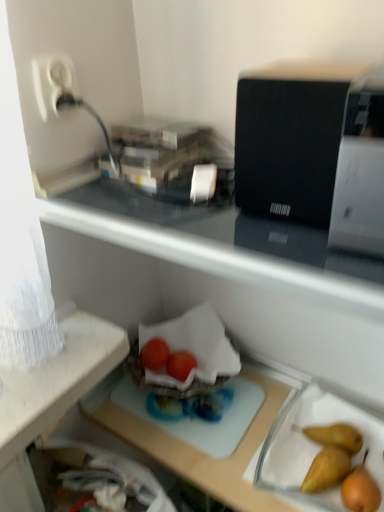
What is the approximate height of glossy plastic tomatoes at center, the first green vegetables when ordered from left to right?

glossy plastic tomatoes at center, the first green vegetables when ordered from left to right, is 2.86 inches tall.

The image size is (384, 512). Describe the element at coordinates (180, 365) in the screenshot. I see `glossy plastic tomatoes at center, which is the first green vegetables in right-to-left order` at that location.

In order to face glossy plastic tomatoes at center, positioned as the 2th green vegetables in left-to-right order, should I rotate leftwards or rightwards?

Turn left approximately 1.354 degrees to face it.

The width and height of the screenshot is (384, 512). I want to click on transparent plastic tray at center, so click(51, 396).

Describe the element at coordinates (361, 170) in the screenshot. I see `white glossy printer at upper right, arranged as the second appliance when viewed from the left` at that location.

Find the location of a particular element. Image resolution: width=384 pixels, height=512 pixels. black matte speaker at upper right, the first appliance positioned from the left is located at coordinates (290, 139).

Find the location of a particular element. smooth brown pear at lower right is located at coordinates (340, 467).

I want to click on glossy plastic tomatoes at center, the second green vegetables viewed from the right, so click(154, 354).

Is transparent plastic tray at center bigger than white glossy printer at upper right, which appears as the first appliance when viewed from the right?

Yes, transparent plastic tray at center is bigger than white glossy printer at upper right, which appears as the first appliance when viewed from the right.

Consider the image. Can you confirm if transparent plastic tray at center is taller than white glossy printer at upper right, which appears as the first appliance when viewed from the right?

Indeed, transparent plastic tray at center has a greater height compared to white glossy printer at upper right, which appears as the first appliance when viewed from the right.

Based on their positions, is transparent plastic tray at center located to the left or right of white glossy printer at upper right, which appears as the first appliance when viewed from the right?

From the image, it's evident that transparent plastic tray at center is to the left of white glossy printer at upper right, which appears as the first appliance when viewed from the right.

Does transparent plastic tray at center lie behind white glossy printer at upper right, arranged as the second appliance when viewed from the left?

Yes.

From a real-world perspective, is glossy plastic tomatoes at center, positioned as the 2th green vegetables in left-to-right order, physically above white plastic plug at upper left?

Incorrect, from a real-world perspective, glossy plastic tomatoes at center, positioned as the 2th green vegetables in left-to-right order, is lower than white plastic plug at upper left.

Could you tell me if glossy plastic tomatoes at center, positioned as the 2th green vegetables in left-to-right order, is turned towards white plastic plug at upper left?

No, glossy plastic tomatoes at center, positioned as the 2th green vegetables in left-to-right order, is not oriented towards white plastic plug at upper left.

From the image's perspective, does glossy plastic tomatoes at center, positioned as the 2th green vegetables in left-to-right order, appear lower than white plastic plug at upper left?

Correct, glossy plastic tomatoes at center, positioned as the 2th green vegetables in left-to-right order, appears lower than white plastic plug at upper left in the image.

Considering the relative sizes of glossy plastic tomatoes at center, which is the first green vegetables in right-to-left order, and white plastic plug at upper left in the image provided, is glossy plastic tomatoes at center, which is the first green vegetables in right-to-left order, smaller than white plastic plug at upper left?

Yes.

Considering the relative sizes of white glossy printer at upper right, which appears as the first appliance when viewed from the right, and glossy plastic tomatoes at center, positioned as the 2th green vegetables in left-to-right order, in the image provided, is white glossy printer at upper right, which appears as the first appliance when viewed from the right, thinner than glossy plastic tomatoes at center, positioned as the 2th green vegetables in left-to-right order,?

Incorrect, the width of white glossy printer at upper right, which appears as the first appliance when viewed from the right, is not less than that of glossy plastic tomatoes at center, positioned as the 2th green vegetables in left-to-right order.

Consider the image. Which is behind, white glossy printer at upper right, which appears as the first appliance when viewed from the right, or glossy plastic tomatoes at center, which is the first green vegetables in right-to-left order?

glossy plastic tomatoes at center, which is the first green vegetables in right-to-left order, is further from the camera.

Could you tell me if white glossy printer at upper right, arranged as the second appliance when viewed from the left, is facing glossy plastic tomatoes at center, which is the first green vegetables in right-to-left order?

No, white glossy printer at upper right, arranged as the second appliance when viewed from the left, is not turned towards glossy plastic tomatoes at center, which is the first green vegetables in right-to-left order.

Considering the sizes of objects white glossy printer at upper right, arranged as the second appliance when viewed from the left, and glossy plastic tomatoes at center, positioned as the 2th green vegetables in left-to-right order, in the image provided, who is smaller, white glossy printer at upper right, arranged as the second appliance when viewed from the left, or glossy plastic tomatoes at center, positioned as the 2th green vegetables in left-to-right order,?

With smaller size is glossy plastic tomatoes at center, positioned as the 2th green vegetables in left-to-right order.

Which is correct: glossy plastic tomatoes at center, the second green vegetables viewed from the right, is inside transparent plastic tray at center, or outside of it?

glossy plastic tomatoes at center, the second green vegetables viewed from the right, can be found inside transparent plastic tray at center.

Which is closer, (160, 354) or (240, 490)?

Point (160, 354) is farther from the camera than point (240, 490).

Based on their positions, is glossy plastic tomatoes at center, the first green vegetables when ordered from left to right, located to the left or right of transparent plastic tray at center?

In the image, glossy plastic tomatoes at center, the first green vegetables when ordered from left to right, appears on the left side of transparent plastic tray at center.

From a real-world perspective, is glossy plastic tomatoes at center, the second green vegetables viewed from the right, positioned above or below transparent plastic tray at center?

Clearly, from a real-world perspective, glossy plastic tomatoes at center, the second green vegetables viewed from the right, is above transparent plastic tray at center.

Can you confirm if white plastic plug at upper left is thinner than transparent plastic tray at center?

Yes.

From the image's perspective, is white plastic plug at upper left over transparent plastic tray at center?

Yes.

Are white plastic plug at upper left and transparent plastic tray at center making contact?

No, white plastic plug at upper left is not next to transparent plastic tray at center.

From the picture: In terms of size, does white plastic plug at upper left appear bigger or smaller than transparent plastic tray at center?

white plastic plug at upper left is smaller than transparent plastic tray at center.

Identify the location of the 1st appliance directly above the glossy plastic tomatoes at center, positioned as the 2th green vegetables in left-to-right order (from a real-world perspective). The height and width of the screenshot is (512, 384). (361, 170).

Is glossy plastic tomatoes at center, positioned as the 2th green vegetables in left-to-right order, wider than white glossy printer at upper right, arranged as the second appliance when viewed from the left?

In fact, glossy plastic tomatoes at center, positioned as the 2th green vegetables in left-to-right order, might be narrower than white glossy printer at upper right, arranged as the second appliance when viewed from the left.

Which object is further away from the camera taking this photo, glossy plastic tomatoes at center, positioned as the 2th green vegetables in left-to-right order, or white glossy printer at upper right, which appears as the first appliance when viewed from the right?

Positioned behind is glossy plastic tomatoes at center, positioned as the 2th green vegetables in left-to-right order.

From a real-world perspective, is glossy plastic tomatoes at center, which is the first green vegetables in right-to-left order, positioned under white glossy printer at upper right, arranged as the second appliance when viewed from the left, based on gravity?

Yes, from a real-world perspective, glossy plastic tomatoes at center, which is the first green vegetables in right-to-left order, is under white glossy printer at upper right, arranged as the second appliance when viewed from the left.

Between glossy plastic tomatoes at center, the first green vegetables when ordered from left to right, and white glossy printer at upper right, which appears as the first appliance when viewed from the right, which one appears on the right side from the viewer's perspective?

white glossy printer at upper right, which appears as the first appliance when viewed from the right, is more to the right.

From a real-world perspective, is glossy plastic tomatoes at center, the second green vegetables viewed from the right, physically located above or below white glossy printer at upper right, arranged as the second appliance when viewed from the left?

glossy plastic tomatoes at center, the second green vegetables viewed from the right, is below white glossy printer at upper right, arranged as the second appliance when viewed from the left.

Between glossy plastic tomatoes at center, the first green vegetables when ordered from left to right, and white glossy printer at upper right, which appears as the first appliance when viewed from the right, which one has larger size?

white glossy printer at upper right, which appears as the first appliance when viewed from the right.

The height and width of the screenshot is (512, 384). I want to click on the 1st appliance positioned above the glossy plastic tomatoes at center, the second green vegetables viewed from the right (from the image's perspective), so click(x=361, y=170).

Identify the location of desk lying below the white glossy printer at upper right, which appears as the first appliance when viewed from the right (from the image's perspective). The width and height of the screenshot is (384, 512). (51, 396).

Locate an element on the screen. electric outlet in front of the glossy plastic tomatoes at center, which is the first green vegetables in right-to-left order is located at coordinates (54, 83).

When comparing their distances from glossy plastic tomatoes at center, the second green vegetables viewed from the right, does smooth brown pear at lower right or black matte speaker at upper right, acting as the second appliance starting from the right, seem closer?

smooth brown pear at lower right is positioned closer to the anchor glossy plastic tomatoes at center, the second green vegetables viewed from the right.

Which object lies further to the anchor point black matte speaker at upper right, acting as the second appliance starting from the right, smooth brown pear at lower right or white glossy printer at upper right, arranged as the second appliance when viewed from the left?

Based on the image, smooth brown pear at lower right appears to be further to black matte speaker at upper right, acting as the second appliance starting from the right.

Considering their positions, is glossy plastic tomatoes at center, positioned as the 2th green vegetables in left-to-right order, positioned closer to transparent plastic tray at center than white glossy printer at upper right, which appears as the first appliance when viewed from the right?

The object closer to transparent plastic tray at center is glossy plastic tomatoes at center, positioned as the 2th green vegetables in left-to-right order.

Based on their spatial positions, is white plastic plug at upper left or transparent plastic tray at center closer to white glossy printer at upper right, arranged as the second appliance when viewed from the left?

white plastic plug at upper left lies closer to white glossy printer at upper right, arranged as the second appliance when viewed from the left, than the other object.

In the scene shown: Considering their positions, is transparent plastic tray at center positioned further to white plastic plug at upper left than black matte speaker at upper right, acting as the second appliance starting from the right?

Among the two, transparent plastic tray at center is located further to white plastic plug at upper left.

Which object lies nearer to the anchor point white plastic plug at upper left, glossy plastic tomatoes at center, the first green vegetables when ordered from left to right, or transparent plastic tray at center?

Among the two, transparent plastic tray at center is located nearer to white plastic plug at upper left.

Based on the photo, which object lies nearer to the anchor point glossy plastic tomatoes at center, the second green vegetables viewed from the right, black matte speaker at upper right, the first appliance positioned from the left, or white plastic plug at upper left?

The object closer to glossy plastic tomatoes at center, the second green vegetables viewed from the right, is white plastic plug at upper left.

Considering their positions, is smooth brown pear at lower right positioned closer to transparent plastic tray at center than white plastic plug at upper left?

smooth brown pear at lower right.

Locate an element on the screen. Image resolution: width=384 pixels, height=512 pixels. green vegetables situated between glossy plastic tomatoes at center, the second green vegetables viewed from the right, and smooth brown pear at lower right from left to right is located at coordinates (180, 365).

This screenshot has width=384, height=512. I want to click on fruit located between white glossy printer at upper right, arranged as the second appliance when viewed from the left, and glossy plastic tomatoes at center, which is the first green vegetables in right-to-left order, in the depth direction, so click(x=340, y=467).

Find the location of `appliance between white plastic plug at upper left and white glossy printer at upper right, which appears as the first appliance when viewed from the right, from left to right`. appliance between white plastic plug at upper left and white glossy printer at upper right, which appears as the first appliance when viewed from the right, from left to right is located at coordinates (290, 139).

The image size is (384, 512). What are the coordinates of `fruit between transparent plastic tray at center and glossy plastic tomatoes at center, which is the first green vegetables in right-to-left order, in the front-back direction` in the screenshot? It's located at (340, 467).